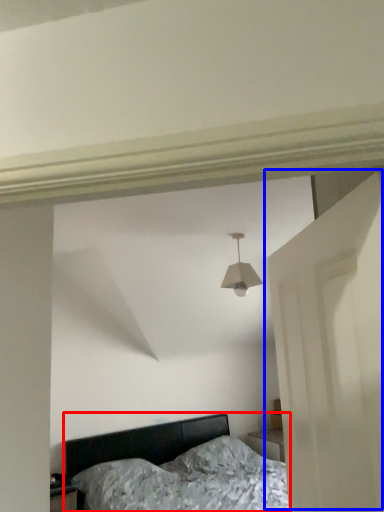
Question: Which object appears closest to the camera in this image, bed (highlighted by a red box) or door (highlighted by a blue box)?

Choices:
 (A) bed
 (B) door

Answer: (B)